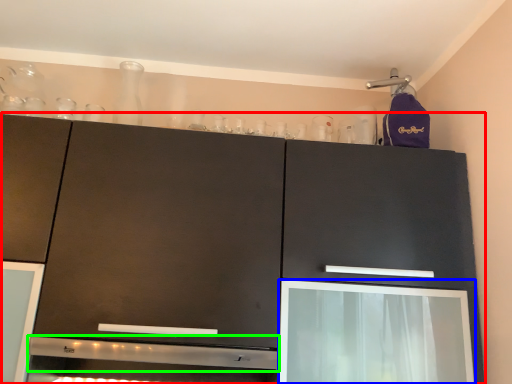
Question: Estimate the real-world distances between objects in this image. Which object is closer to cabinetry (highlighted by a red box), screen door (highlighted by a blue box) or exhaust hood (highlighted by a green box)?

Choices:
 (A) screen door
 (B) exhaust hood

Answer: (A)